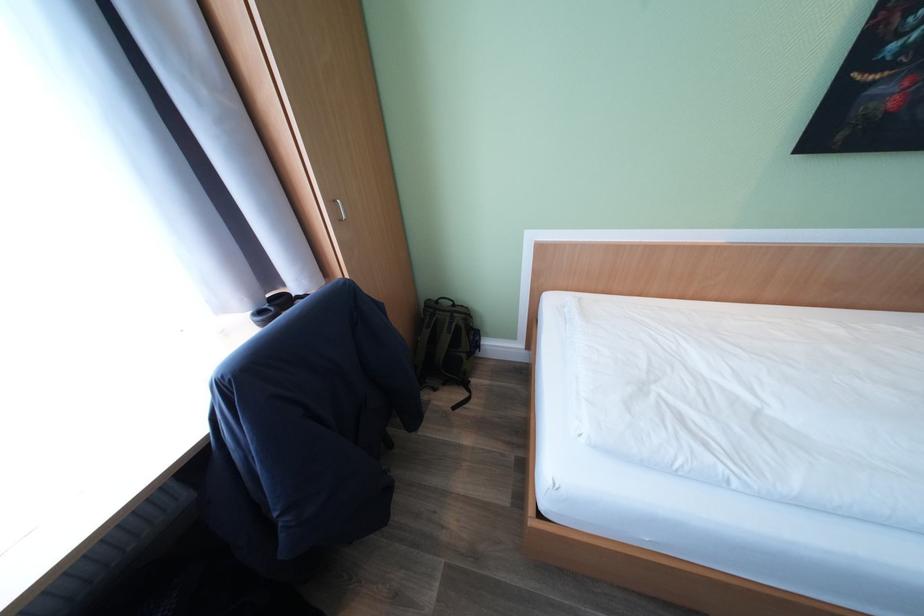
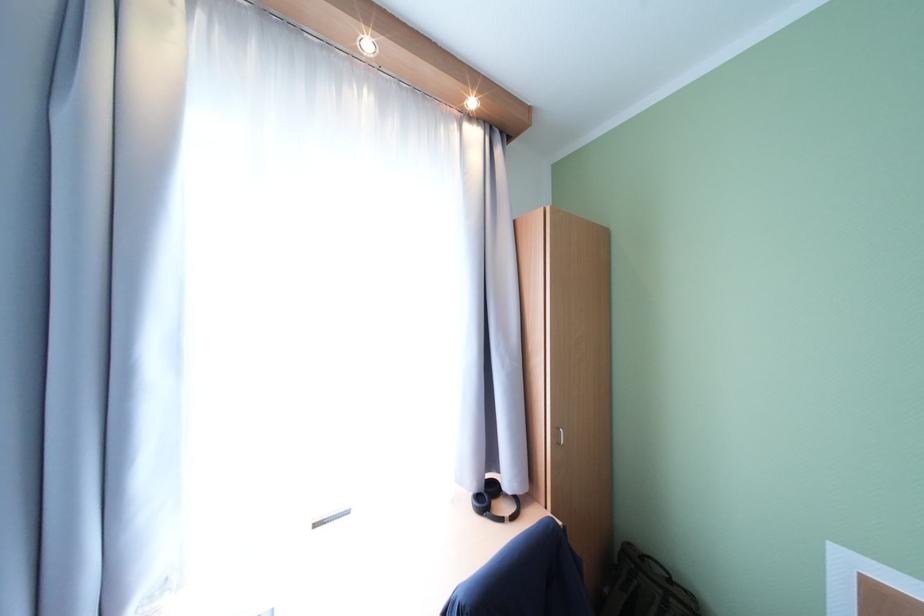
The point at (344, 220) is marked in the first image. Where is the corresponding point in the second image?

(563, 444)